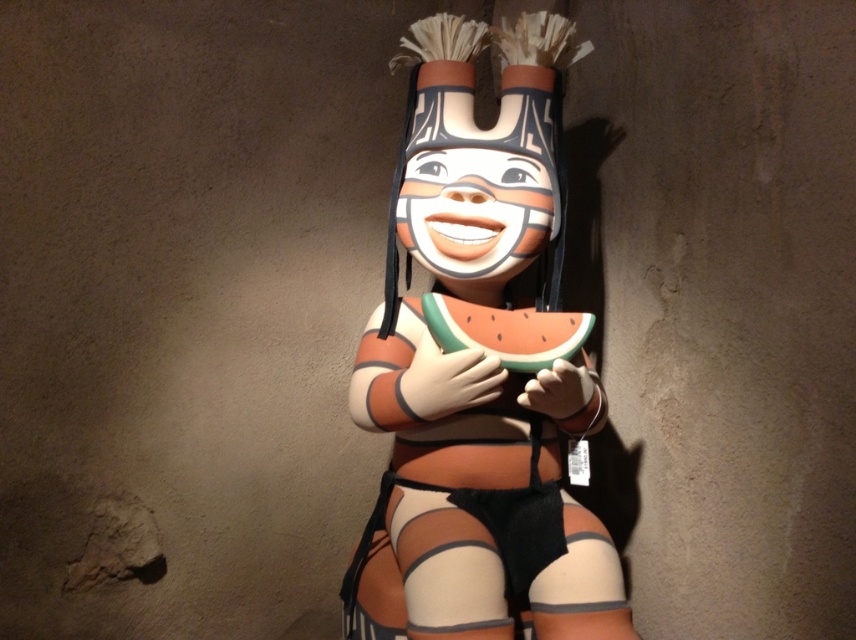
Question: Does matte plastic kachina doll at center have a smaller size compared to green matte watermelon at center?

Choices:
 (A) yes
 (B) no

Answer: (B)

Question: Is matte plastic kachina doll at center smaller than green matte watermelon at center?

Choices:
 (A) no
 (B) yes

Answer: (A)

Question: Which of the following is the farthest from the observer?

Choices:
 (A) green matte watermelon at center
 (B) matte plastic kachina doll at center

Answer: (A)

Question: Can you confirm if matte plastic kachina doll at center is positioned below green matte watermelon at center?

Choices:
 (A) no
 (B) yes

Answer: (A)

Question: Among these points, which one is nearest to the camera?

Choices:
 (A) (375, 522)
 (B) (492, 348)

Answer: (B)

Question: Which object appears closest to the camera in this image?

Choices:
 (A) matte plastic kachina doll at center
 (B) green matte watermelon at center

Answer: (A)